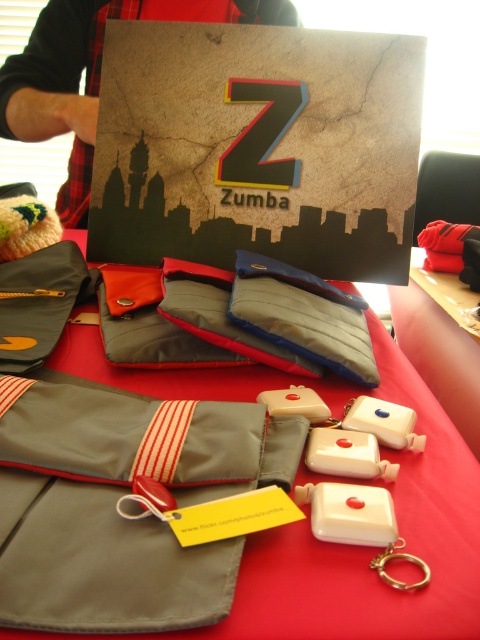
Does point (24, 618) come farther from viewer compared to point (90, 83)?

That is False.

Consider the image. Is gray fabric pouch at center taller than red plaid shirt at upper left?

No.

What do you see at coordinates (123, 502) in the screenshot? Image resolution: width=480 pixels, height=640 pixels. I see `gray fabric pouch at center` at bounding box center [123, 502].

This screenshot has width=480, height=640. What are the coordinates of `gray fabric pouch at center` in the screenshot? It's located at (123, 502).

Who is shorter, red fabric tablecloth at center or red plaid shirt at upper left?

With less height is red fabric tablecloth at center.

Based on the photo, between red fabric tablecloth at center and red plaid shirt at upper left, which one appears on the left side from the viewer's perspective?

red plaid shirt at upper left is more to the left.

Measure the distance between point (392, 376) and camera.

A distance of 22.52 inches exists between point (392, 376) and camera.

Identify the location of red fabric tablecloth at center. (371, 548).

From the picture: Which of these two, gray fabric pouch at center or red fabric tablecloth at center, stands shorter?

gray fabric pouch at center

Is point (69, 419) in front of point (420, 388)?

That is True.

Find the location of a particular element. Image resolution: width=480 pixels, height=640 pixels. gray fabric pouch at center is located at coordinates (123, 502).